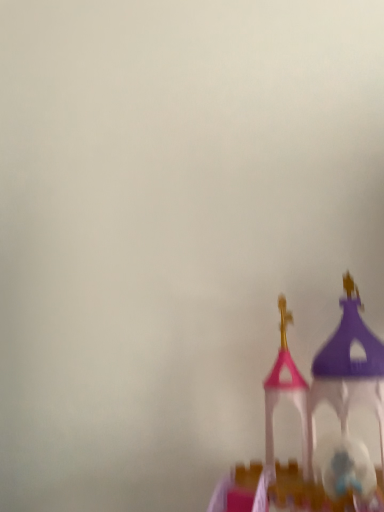
This screenshot has width=384, height=512. What do you see at coordinates (314, 426) in the screenshot?
I see `pink plastic castle at lower right` at bounding box center [314, 426].

What is the approximate height of pink plastic castle at lower right?

15.37 inches.

The width and height of the screenshot is (384, 512). I want to click on pink plastic castle at lower right, so click(314, 426).

You are a GUI agent. You are given a task and a screenshot of the screen. Output one action in this format:
    pyautogui.click(x=<x>, y=<y>)
    Task: Click on the pink plastic castle at lower right
    This screenshot has width=384, height=512.
    Given the screenshot: What is the action you would take?
    pyautogui.click(x=314, y=426)